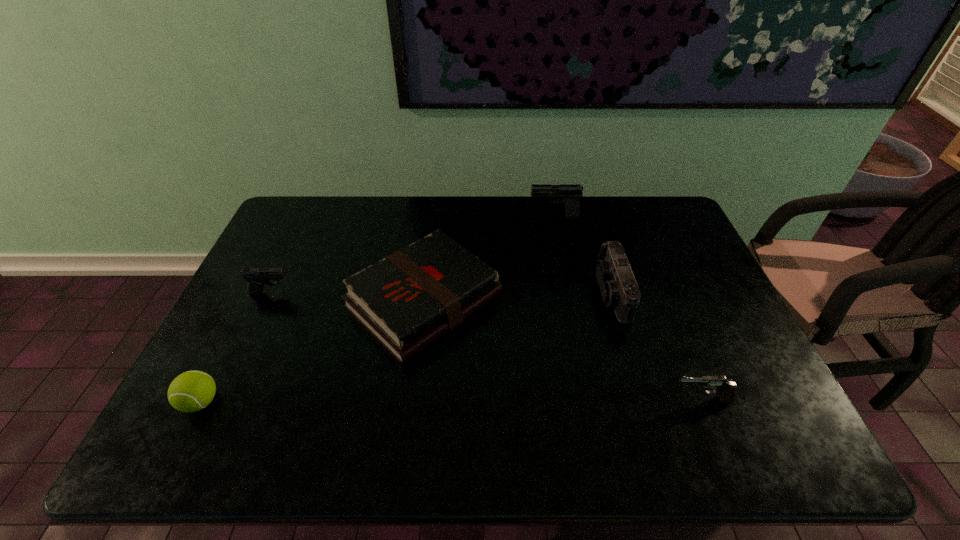
Where is `object situated at the far edge`? object situated at the far edge is located at coordinates (571, 192).

Find the location of `pistol situated at the left edge`. pistol situated at the left edge is located at coordinates (257, 277).

Locate an element on the screen. tennis ball that is positioned at the left edge is located at coordinates (191, 391).

The height and width of the screenshot is (540, 960). Identify the location of object that is at the right edge. (726, 389).

In the image, there is a desktop. What are the coordinates of `free space at the far edge` in the screenshot? It's located at point(360,223).

Find the location of `blank space at the near edge of the desktop`. blank space at the near edge of the desktop is located at coordinates (319, 438).

This screenshot has height=540, width=960. In the image, there is a desktop. What are the coordinates of `blank space at the left edge` in the screenshot? It's located at (231, 401).

This screenshot has height=540, width=960. In the image, there is a desktop. Identify the location of vacant space at the right edge. (652, 244).

The width and height of the screenshot is (960, 540). I want to click on free space at the far left corner of the desktop, so click(298, 224).

Where is `vacant region at the near left corner of the desktop`? vacant region at the near left corner of the desktop is located at coordinates (163, 456).